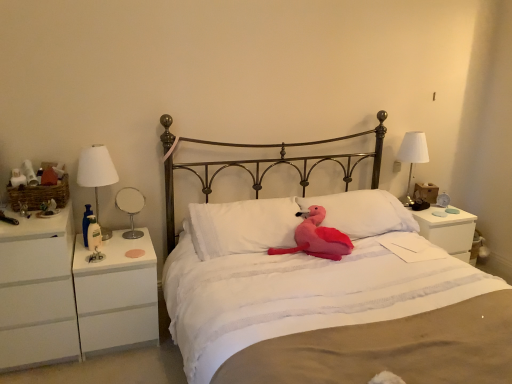
This screenshot has height=384, width=512. Find the location of `free spot to the right of white fabric lampshade at left, positioned as the 1th bedside lamp in left-to-right order`. free spot to the right of white fabric lampshade at left, positioned as the 1th bedside lamp in left-to-right order is located at coordinates (134, 245).